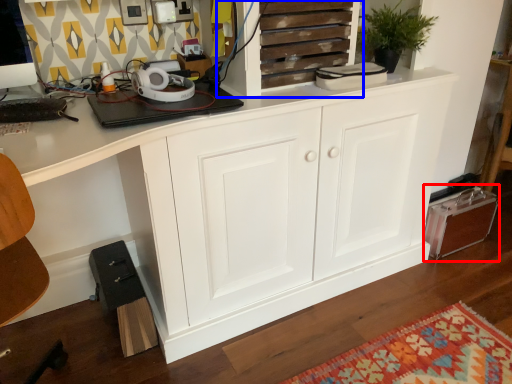
Question: Which object is further to the camera taking this photo, cabinetry (highlighted by a red box) or cupboard (highlighted by a blue box)?

Choices:
 (A) cabinetry
 (B) cupboard

Answer: (A)